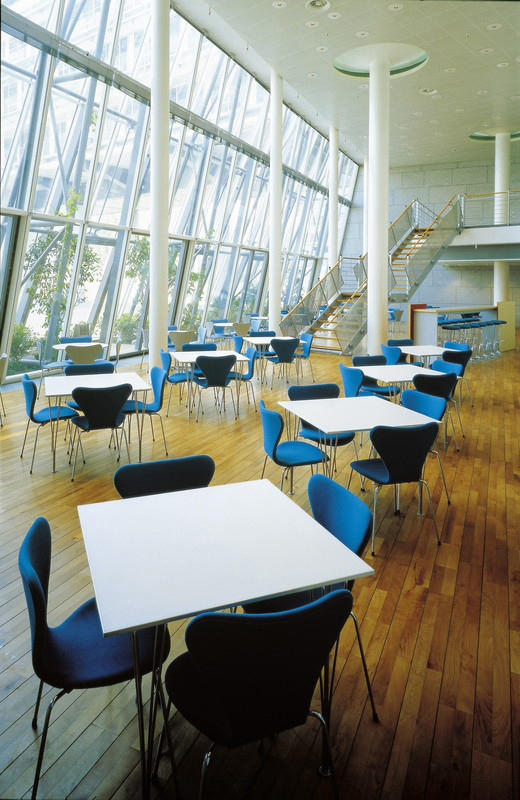
Image resolution: width=520 pixels, height=800 pixels. Find the location of `white tables`. white tables is located at coordinates (176, 562), (343, 410), (398, 369), (421, 350), (260, 334), (183, 354), (121, 378), (61, 344), (224, 325), (260, 320).